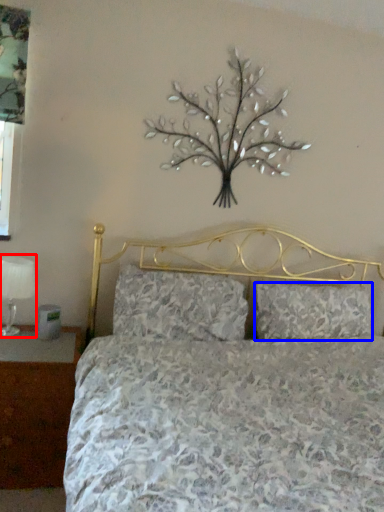
Question: Which object appears closest to the camera in this image, table lamp (highlighted by a red box) or pillow (highlighted by a blue box)?

Choices:
 (A) table lamp
 (B) pillow

Answer: (A)